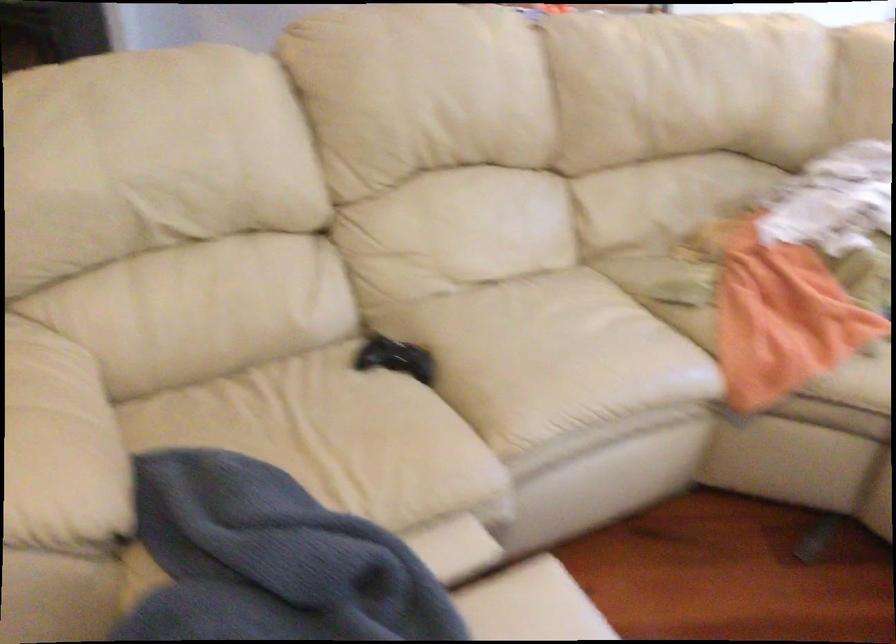
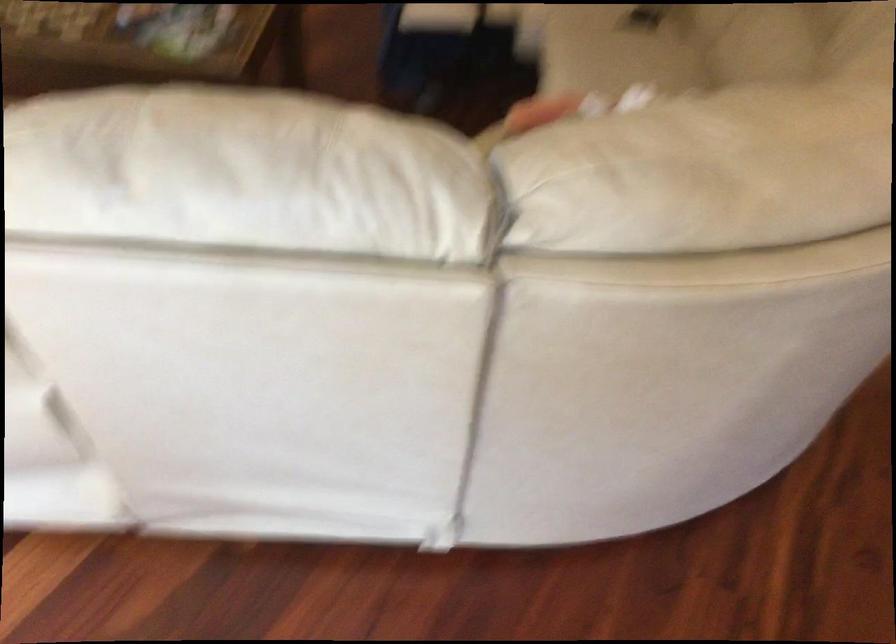
Find the pixel in the second image that matches (569,339) in the first image.

(616, 49)